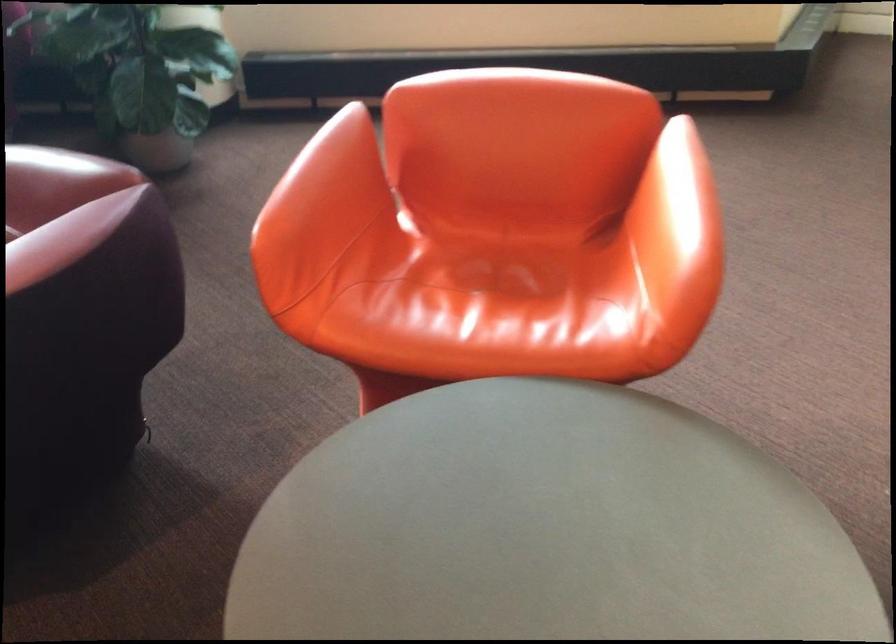
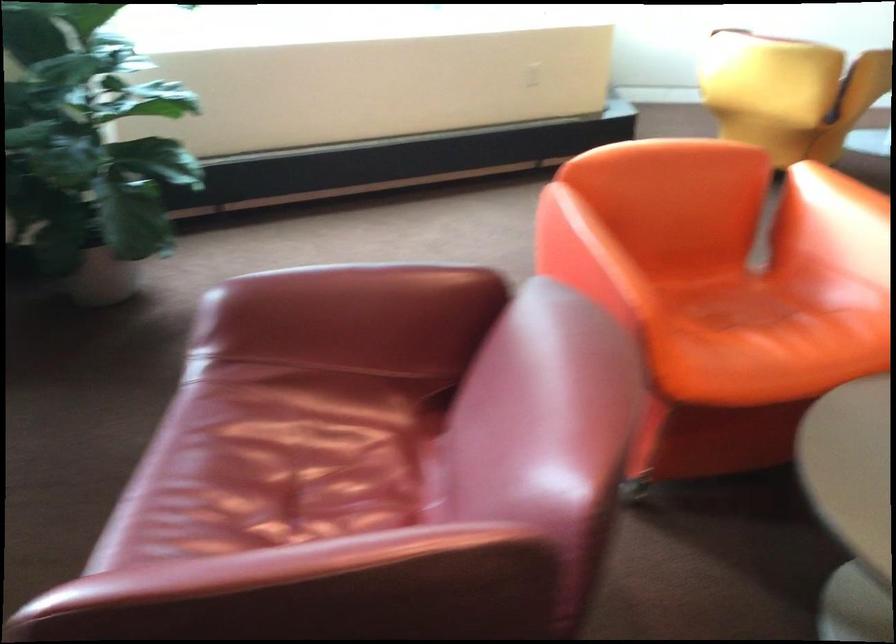
Question: In a continuous first-person perspective shot, in which direction is the camera moving?

Choices:
 (A) Left
 (B) Right
 (C) Forward
 (D) Backward

Answer: (A)